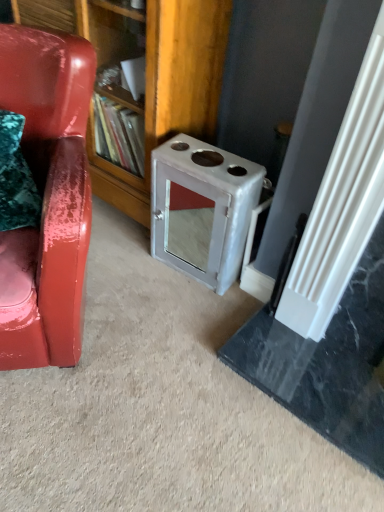
The image size is (384, 512). In order to click on free space to the back side of metallic gray stove at center-right in this screenshot , I will do `click(190, 232)`.